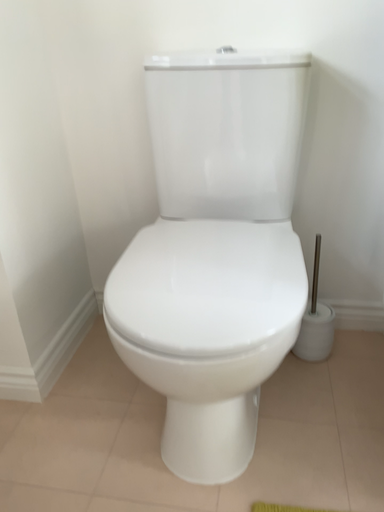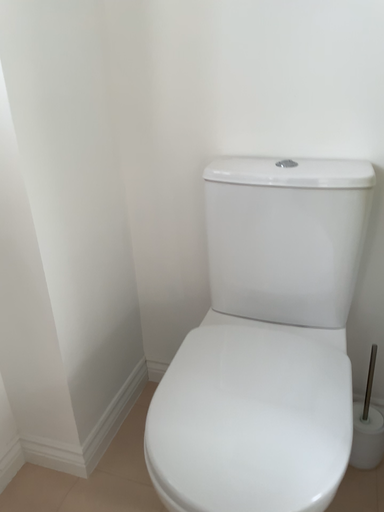
Question: Which way did the camera rotate in the video?

Choices:
 (A) rotated right
 (B) rotated left

Answer: (B)